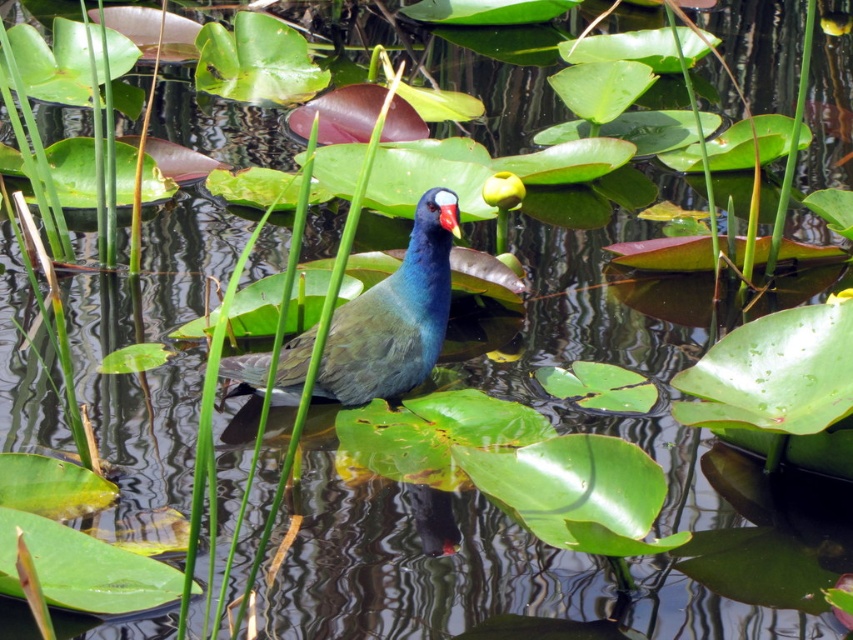
Who is taller, purple glossy bird at center or purple glossy beak at center?

purple glossy bird at center

Does purple glossy bird at center have a smaller size compared to purple glossy beak at center?

No, purple glossy bird at center is not smaller than purple glossy beak at center.

Is point (415, 340) positioned behind point (454, 234)?

That is True.

Locate an element on the screen. Image resolution: width=853 pixels, height=640 pixels. purple glossy bird at center is located at coordinates (392, 320).